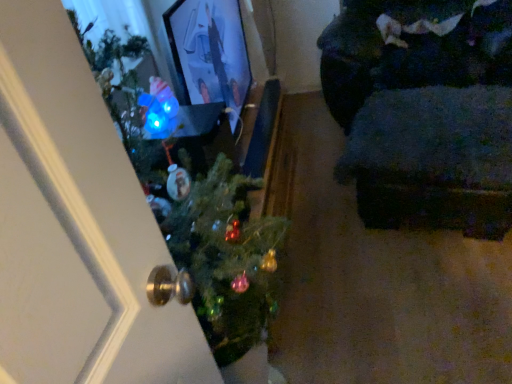
I want to click on green matte christmas tree at center, so click(197, 210).

Image resolution: width=512 pixels, height=384 pixels. What do you see at coordinates (197, 210) in the screenshot?
I see `green matte christmas tree at center` at bounding box center [197, 210].

Find the location of a particular element. dark fabric couch at right is located at coordinates (424, 111).

The width and height of the screenshot is (512, 384). Describe the element at coordinates (424, 111) in the screenshot. I see `dark fabric couch at right` at that location.

What is the approximate width of dark fabric couch at right?

dark fabric couch at right is 27.68 inches wide.

Locate an element on the screen. The image size is (512, 384). green matte christmas tree at center is located at coordinates (197, 210).

Would you say dark fabric couch at right is to the left or to the right of green matte christmas tree at center in the picture?

Clearly, dark fabric couch at right is on the right of green matte christmas tree at center in the image.

Is the position of dark fabric couch at right less distant than that of green matte christmas tree at center?

No, dark fabric couch at right is further to the viewer.

Considering the positions of points (416, 29) and (225, 269), is point (416, 29) closer to camera compared to point (225, 269)?

That is False.

From the image's perspective, which one is positioned higher, dark fabric couch at right or green matte christmas tree at center?

From the image's view, dark fabric couch at right is above.

From a real-world perspective, is dark fabric couch at right positioned over green matte christmas tree at center based on gravity?

No.

In the scene shown: Considering the sizes of objects dark fabric couch at right and green matte christmas tree at center in the image provided, who is wider, dark fabric couch at right or green matte christmas tree at center?

dark fabric couch at right.

Can you confirm if dark fabric couch at right is shorter than green matte christmas tree at center?

Correct, dark fabric couch at right is not as tall as green matte christmas tree at center.

Considering the sizes of objects dark fabric couch at right and green matte christmas tree at center in the image provided, who is smaller, dark fabric couch at right or green matte christmas tree at center?

With smaller size is green matte christmas tree at center.

Is dark fabric couch at right surrounding green matte christmas tree at center?

No, green matte christmas tree at center is not a part of dark fabric couch at right.

Is dark fabric couch at right placed right next to green matte christmas tree at center?

No, dark fabric couch at right is not in contact with green matte christmas tree at center.

Based on the photo, is dark fabric couch at right looking in the opposite direction of green matte christmas tree at center?

No, dark fabric couch at right is not facing the opposite direction of green matte christmas tree at center.

You are a GUI agent. You are given a task and a screenshot of the screen. Output one action in this format:
    pyautogui.click(x=<x>, y=<y>)
    Task: Click on the furniture located on the right of green matte christmas tree at center
    Image resolution: width=512 pixels, height=384 pixels.
    Given the screenshot: What is the action you would take?
    pyautogui.click(x=424, y=111)

Can you confirm if green matte christmas tree at center is positioned to the left of dark fabric couch at right?

Yes.

Which object is more forward, green matte christmas tree at center or dark fabric couch at right?

green matte christmas tree at center is more forward.

Does point (211, 193) come in front of point (481, 81)?

That is True.

From the image's perspective, is green matte christmas tree at center located above or below dark fabric couch at right?

green matte christmas tree at center is situated lower than dark fabric couch at right in the image.

From a real-world perspective, is green matte christmas tree at center positioned under dark fabric couch at right based on gravity?

Incorrect, from a real-world perspective, green matte christmas tree at center is higher than dark fabric couch at right.

Does green matte christmas tree at center have a greater width compared to dark fabric couch at right?

In fact, green matte christmas tree at center might be narrower than dark fabric couch at right.

Considering the sizes of objects green matte christmas tree at center and dark fabric couch at right in the image provided, who is taller, green matte christmas tree at center or dark fabric couch at right?

green matte christmas tree at center.

From the picture: Between green matte christmas tree at center and dark fabric couch at right, which one has larger size?

Bigger between the two is dark fabric couch at right.

Could dark fabric couch at right be considered to be inside green matte christmas tree at center?

No, dark fabric couch at right is not a part of green matte christmas tree at center.

Looking at this image, would you consider green matte christmas tree at center to be distant from dark fabric couch at right?

Absolutely, green matte christmas tree at center is distant from dark fabric couch at right.

Does green matte christmas tree at center turn towards dark fabric couch at right?

No, green matte christmas tree at center does not turn towards dark fabric couch at right.

What's the angular difference between green matte christmas tree at center and dark fabric couch at right's facing directions?

The facing directions of green matte christmas tree at center and dark fabric couch at right are 110 degrees apart.

What are the coordinates of `furniture on the right of green matte christmas tree at center` in the screenshot? It's located at (424, 111).

I want to click on christmas tree above the dark fabric couch at right (from a real-world perspective), so click(197, 210).

Where is `christmas tree below the dark fabric couch at right (from the image's perspective)`? This screenshot has height=384, width=512. christmas tree below the dark fabric couch at right (from the image's perspective) is located at coordinates (197, 210).